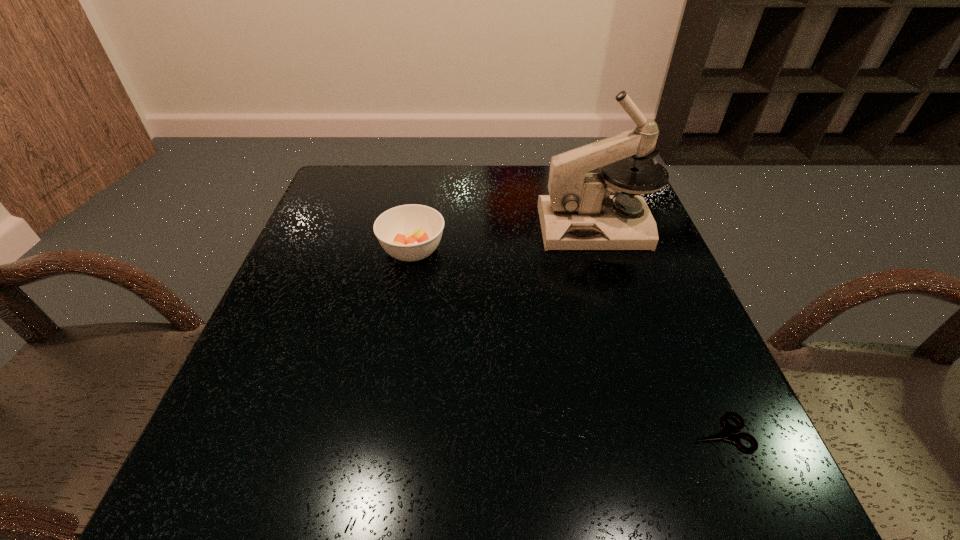
Where is `the tallest object`? The image size is (960, 540). the tallest object is located at coordinates (579, 213).

At what (x,y) coordinates should I click in order to perform the action: click on the leftmost object. Please return your answer as a coordinate pair (x, y). Looking at the image, I should click on (412, 232).

Image resolution: width=960 pixels, height=540 pixels. In order to click on soup bowl in this screenshot , I will do `click(412, 232)`.

You are a GUI agent. You are given a task and a screenshot of the screen. Output one action in this format:
    pyautogui.click(x=<x>, y=<y>)
    Task: Click on the nearest object
    The height and width of the screenshot is (540, 960).
    Given the screenshot: What is the action you would take?
    pyautogui.click(x=725, y=433)

This screenshot has height=540, width=960. I want to click on shears, so click(x=725, y=433).

Where is `vacant region located 0.320m at the eyepiece of the microscope`? The height and width of the screenshot is (540, 960). vacant region located 0.320m at the eyepiece of the microscope is located at coordinates (411, 227).

The height and width of the screenshot is (540, 960). Find the location of `vacant area situated at the eyepiece of the microscope`. vacant area situated at the eyepiece of the microscope is located at coordinates (422, 227).

You are a GUI agent. You are given a task and a screenshot of the screen. Output one action in this format:
    pyautogui.click(x=<x>, y=<y>)
    Task: Click on the free space located at the eyepiece of the microscope
    This screenshot has height=540, width=960.
    Given the screenshot: What is the action you would take?
    pyautogui.click(x=468, y=227)

The height and width of the screenshot is (540, 960). Find the location of `vacant space situated on the front of the second shortest object`. vacant space situated on the front of the second shortest object is located at coordinates (394, 360).

In order to click on free spot located on the front of the shortest object in this screenshot , I will do `click(746, 495)`.